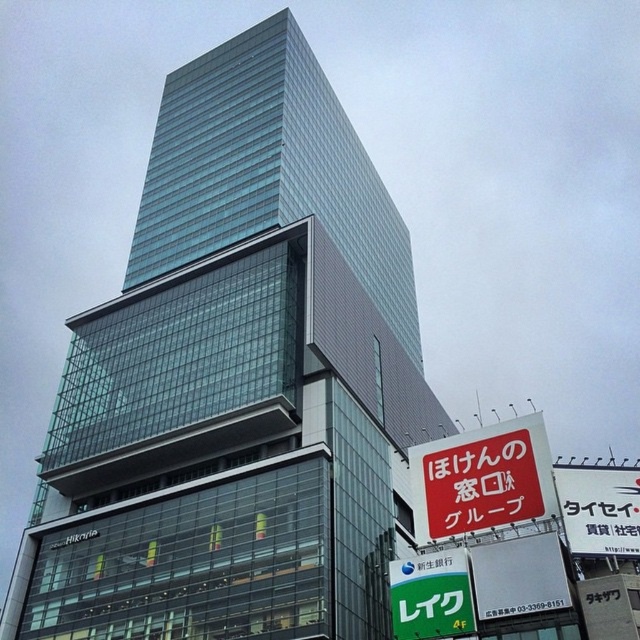
You are standing at the center of the image. Which direction should you look to see the transparent glass building at center?

The transparent glass building at center is already at the center of the image, so you should look straight ahead to see it.

You are standing in front of the building and want to place a new 12 feet wide advertisement sign between the red paper sign at lower right and the green plastic sign at lower center. Can the new sign fit between them?

The distance between the red paper sign at lower right and the green plastic sign at lower center is 13.90 feet. Since the new sign is 12 feet wide, it can fit between them as there is enough space.

You are standing in front of the building and want to read the red paper sign at lower right. Which direction should you look relative to the transparent glass building at center?

The transparent glass building at center is above the red paper sign at lower right, so you should look downward from the transparent glass building at center to see the red paper sign at lower right.